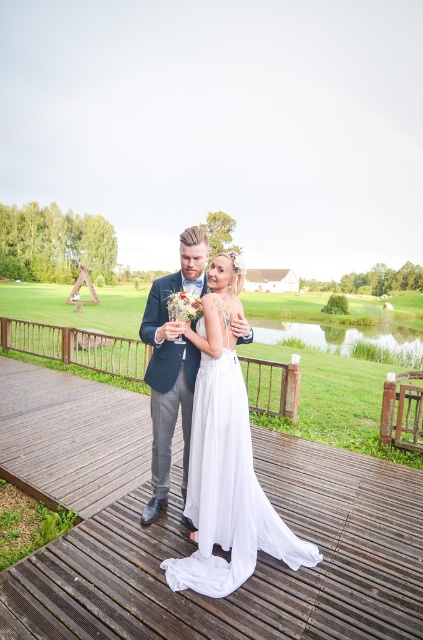
You are a photographer positioned at the edge of the wooden deck at center. You need to capture a closeup shot of the white satin dress at center without moving the couple. Can you reach the dress with your camera lens? Explain your reasoning.

The wooden deck at center is 1.29 meters away from the white satin dress at center. Since the photographer is on the deck, they can use a zoom lens to capture the closeup shot of the white satin dress at center without needing to move closer.

In the scene shown: You are a photographer positioned at the camera. You notice two points in the scene, one at point (219, 540) and another at point (205, 282). Which point will appear larger in your camera view?

Point (219, 540) is closer to the camera than point (205, 282), so it will appear larger in the camera view.

You are a photographer at the wedding. You need to adjust the lighting so that the white satin dress at center and the matte blue suit at center are both well illuminated. Based on their positions, which one is lower and might need more light directed downward?

The white satin dress at center is positioned under the matte blue suit at center, so it is lower and might need more light directed downward to ensure proper illumination.